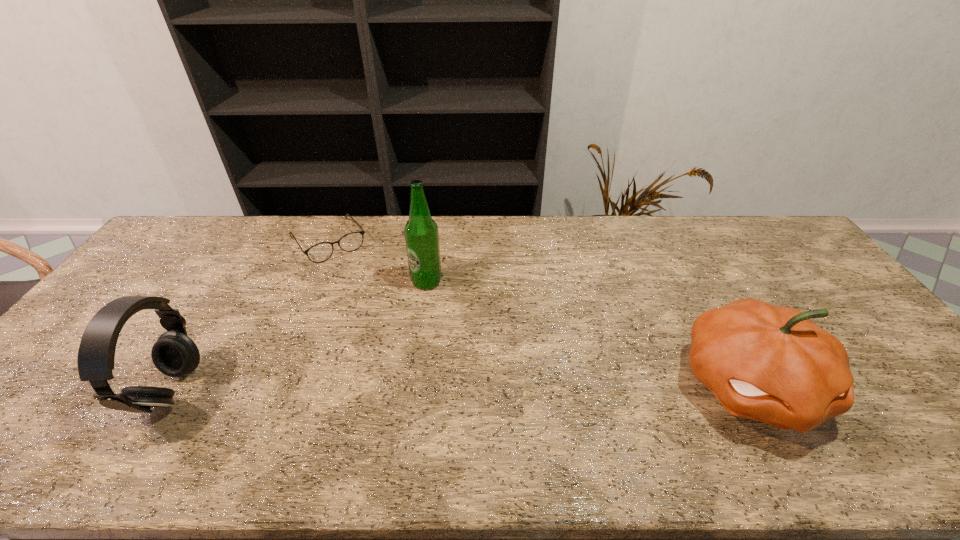
The height and width of the screenshot is (540, 960). I want to click on earphone, so click(x=174, y=354).

Image resolution: width=960 pixels, height=540 pixels. Identify the location of the rightmost object. (773, 364).

Identify the location of the second object from left to right. The height and width of the screenshot is (540, 960). (320, 252).

Image resolution: width=960 pixels, height=540 pixels. In order to click on the farthest object in this screenshot , I will do `click(320, 252)`.

What are the coordinates of `the third object from left to right` in the screenshot? It's located at (421, 233).

At what (x,y) coordinates should I click in order to perform the action: click on the second farthest object. Please return your answer as a coordinate pair (x, y). Looking at the image, I should click on (421, 233).

You are a GUI agent. You are given a task and a screenshot of the screen. Output one action in this format:
    pyautogui.click(x=<x>, y=<y>)
    Task: Click on the vacant area located on the ear cups of the earphone
    This screenshot has width=960, height=540.
    Given the screenshot: What is the action you would take?
    pyautogui.click(x=256, y=392)

Identify the location of free region located on the front-facing side of the shortest object. Image resolution: width=960 pixels, height=540 pixels. (350, 273).

This screenshot has width=960, height=540. Identify the location of vacant space situated on the front-facing side of the shortest object. (389, 329).

Locate an element on the screen. The image size is (960, 540). vacant space located on the front-facing side of the shortest object is located at coordinates (350, 273).